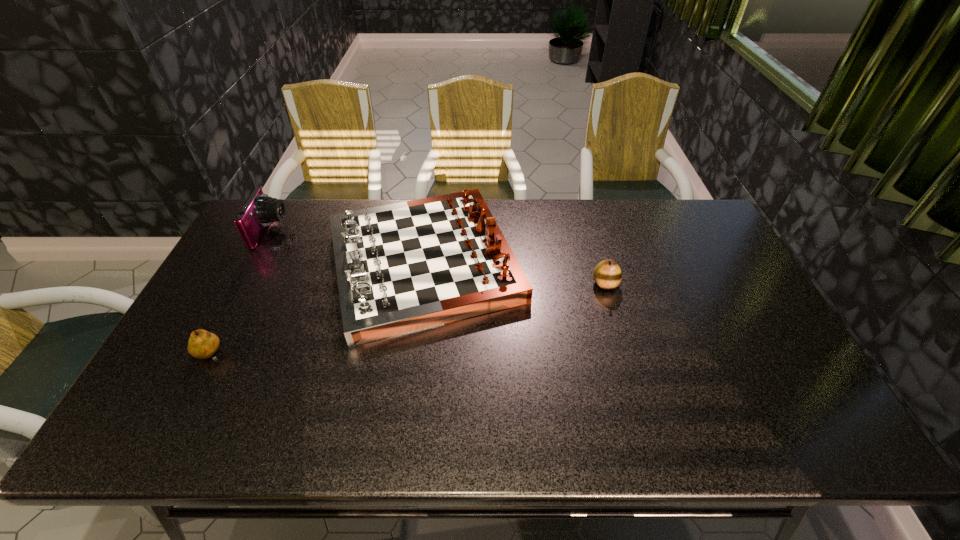
Locate an element on the screen. vacant region between the tallest object and the shorter pear is located at coordinates (318, 309).

The image size is (960, 540). I want to click on vacant point located between the nearer pear and the gameboard, so point(318,309).

The width and height of the screenshot is (960, 540). I want to click on vacant area that lies between the camera and the nearer pear, so click(x=241, y=294).

The width and height of the screenshot is (960, 540). I want to click on object that is the third nearest to the rightmost object, so click(260, 210).

You are a GUI agent. You are given a task and a screenshot of the screen. Output one action in this format:
    pyautogui.click(x=<x>, y=<y>)
    Task: Click on the object that can be found as the third closest to the shorter pear
    The width and height of the screenshot is (960, 540).
    Given the screenshot: What is the action you would take?
    pyautogui.click(x=607, y=274)

Locate an element on the screen. This screenshot has width=960, height=540. vacant space that satisfies the following two spatial constraints: 1. on the front-facing side of the camera; 2. on the left side of the right pear is located at coordinates (243, 284).

Find the location of a particular element. free space that satisfies the following two spatial constraints: 1. on the front-facing side of the camera; 2. on the back side of the shortest object is located at coordinates (205, 355).

Locate an element on the screen. blank space that satisfies the following two spatial constraints: 1. on the front-facing side of the camera; 2. on the left side of the right pear is located at coordinates (243, 284).

This screenshot has width=960, height=540. I want to click on vacant region that satisfies the following two spatial constraints: 1. on the front-facing side of the camera; 2. on the right side of the right pear, so click(x=243, y=284).

Image resolution: width=960 pixels, height=540 pixels. What are the coordinates of `vacant space that satisfies the following two spatial constraints: 1. on the front-facing side of the camera; 2. on the right side of the gameboard` in the screenshot? It's located at (254, 263).